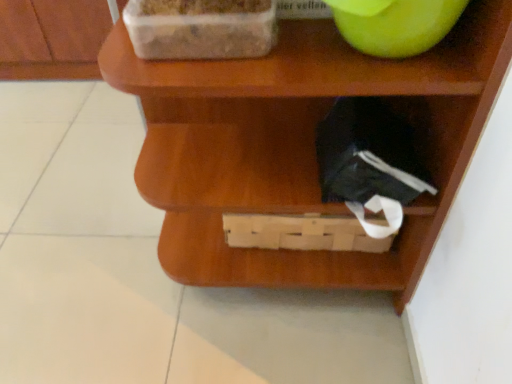
Question: Can you confirm if green matte apple at upper right is bigger than wooden basket at lower center?

Choices:
 (A) yes
 (B) no

Answer: (B)

Question: From a real-world perspective, is green matte apple at upper right positioned over wooden basket at lower center based on gravity?

Choices:
 (A) yes
 (B) no

Answer: (A)

Question: Can you confirm if green matte apple at upper right is shorter than wooden basket at lower center?

Choices:
 (A) no
 (B) yes

Answer: (B)

Question: Does green matte apple at upper right have a lesser width compared to wooden basket at lower center?

Choices:
 (A) yes
 (B) no

Answer: (A)

Question: Is green matte apple at upper right turned away from wooden basket at lower center?

Choices:
 (A) no
 (B) yes

Answer: (B)

Question: From the image's perspective, is green matte apple at upper right on top of wooden basket at lower center?

Choices:
 (A) no
 (B) yes

Answer: (B)

Question: Can you confirm if wooden basket at lower center is positioned to the right of green matte apple at upper right?

Choices:
 (A) yes
 (B) no

Answer: (B)

Question: Is wooden basket at lower center thinner than green matte apple at upper right?

Choices:
 (A) yes
 (B) no

Answer: (B)

Question: Is wooden basket at lower center behind green matte apple at upper right?

Choices:
 (A) no
 (B) yes

Answer: (A)

Question: Is wooden basket at lower center not inside green matte apple at upper right?

Choices:
 (A) no
 (B) yes

Answer: (B)

Question: Is wooden basket at lower center next to green matte apple at upper right and touching it?

Choices:
 (A) no
 (B) yes

Answer: (A)

Question: Is wooden basket at lower center far from green matte apple at upper right?

Choices:
 (A) no
 (B) yes

Answer: (A)

Question: Is the surface of green matte apple at upper right in direct contact with transparent plastic container at upper left?

Choices:
 (A) yes
 (B) no

Answer: (B)